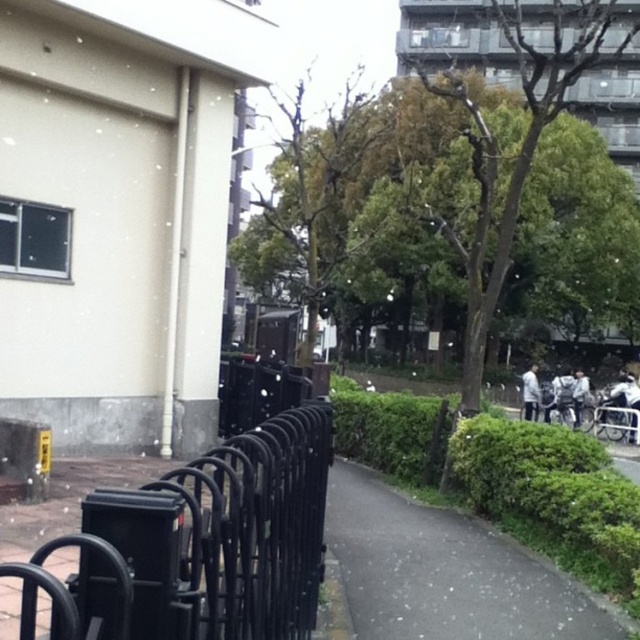
Question: Which object is positioned closest to the green grass at lower right?

Choices:
 (A) light gray fabric jacket at right
 (B) black metal fence at left

Answer: (B)

Question: Which object is the farthest from the white matte jacket at right?

Choices:
 (A) black metal fence at left
 (B) light gray fabric jacket at right
 (C) green grass at lower right

Answer: (A)

Question: Does black metal fence at left appear on the left side of light gray fabric jacket at right?

Choices:
 (A) yes
 (B) no

Answer: (A)

Question: Which of the following is the farthest from the observer?

Choices:
 (A) white matte jacket at right
 (B) light gray fabric jacket at right
 (C) green grass at lower right

Answer: (A)

Question: Is white matte jacket at right to the right of light gray fabric jacket at right from the viewer's perspective?

Choices:
 (A) yes
 (B) no

Answer: (B)

Question: Does black metal fence at left have a larger size compared to light gray fabric jacket at right?

Choices:
 (A) yes
 (B) no

Answer: (B)